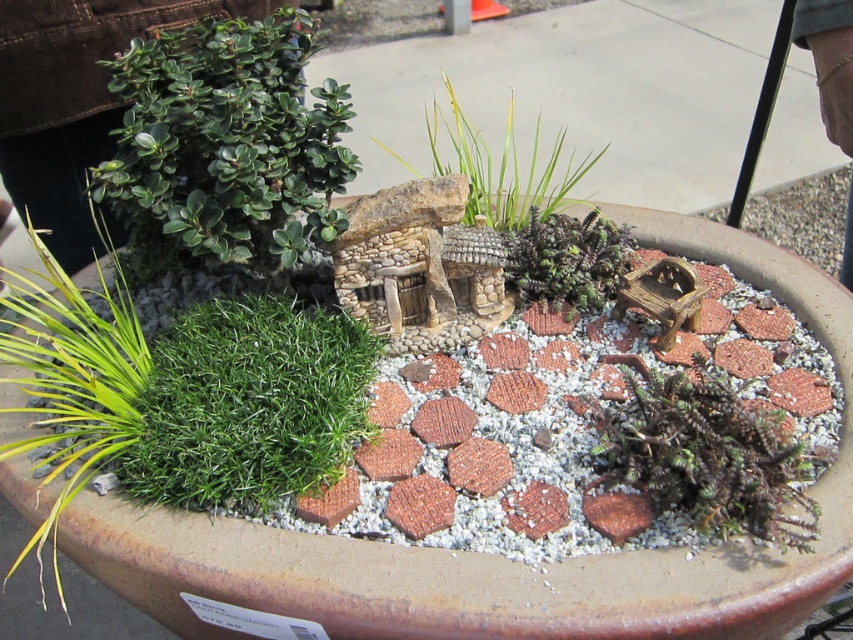
Question: Does green grass at upper left appear on the left side of dark green moss at center?

Choices:
 (A) no
 (B) yes

Answer: (B)

Question: Which point is closer to the camera?

Choices:
 (A) (358, 557)
 (B) (200, 170)
 (C) (277, 324)
 (D) (461, 150)

Answer: (A)

Question: Among these objects, which one is farthest from the camera?

Choices:
 (A) green grass at upper left
 (B) green succulent at center
 (C) green matte plant at upper left

Answer: (B)

Question: From the image, what is the correct spatial relationship of rustic stone bird bath at center in relation to green grass at upper left?

Choices:
 (A) below
 (B) above

Answer: (A)

Question: Does rustic stone bird bath at center have a smaller size compared to dark green moss at center?

Choices:
 (A) no
 (B) yes

Answer: (A)

Question: Based on their relative distances, which object is farther from the green grass at center?

Choices:
 (A) dark green moss at center
 (B) green grass at upper left

Answer: (B)